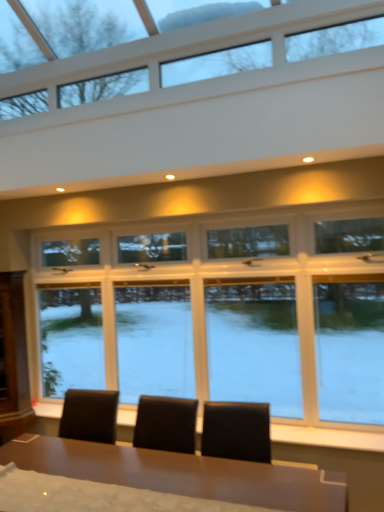
Question: Considering the relative positions of clear glass window at upper center, positioned as the first window in top-to-bottom order, and clear glass window at center, which appears as the 2th window when viewed from the top, in the image provided, is clear glass window at upper center, positioned as the first window in top-to-bottom order, in front of clear glass window at center, which appears as the 2th window when viewed from the top,?

Choices:
 (A) no
 (B) yes

Answer: (B)

Question: Can you see clear glass window at upper center, positioned as the first window in top-to-bottom order, touching clear glass window at center, which appears as the 2th window when viewed from the top?

Choices:
 (A) yes
 (B) no

Answer: (B)

Question: Can you confirm if clear glass window at upper center, the second window in the bottom-to-top sequence, is bigger than clear glass window at center, which is the first window from bottom to top?

Choices:
 (A) no
 (B) yes

Answer: (A)

Question: Is clear glass window at upper center, the second window in the bottom-to-top sequence, turned away from clear glass window at center, which appears as the 2th window when viewed from the top?

Choices:
 (A) yes
 (B) no

Answer: (B)

Question: From the image's perspective, is clear glass window at upper center, positioned as the first window in top-to-bottom order, beneath clear glass window at center, which is the first window from bottom to top?

Choices:
 (A) yes
 (B) no

Answer: (B)

Question: Does clear glass window at upper center, positioned as the first window in top-to-bottom order, appear on the left side of clear glass window at center, which is the first window from bottom to top?

Choices:
 (A) no
 (B) yes

Answer: (B)

Question: From a real-world perspective, is clear glass window at center, which appears as the 2th window when viewed from the top, on clear glass window at upper center, the second window in the bottom-to-top sequence?

Choices:
 (A) yes
 (B) no

Answer: (B)

Question: Is clear glass window at center, which appears as the 2th window when viewed from the top, aimed at clear glass window at upper center, positioned as the first window in top-to-bottom order?

Choices:
 (A) no
 (B) yes

Answer: (B)

Question: Is clear glass window at upper center, positioned as the first window in top-to-bottom order, a part of clear glass window at center, which appears as the 2th window when viewed from the top?

Choices:
 (A) yes
 (B) no

Answer: (B)

Question: From the image's perspective, is clear glass window at center, which appears as the 2th window when viewed from the top, over clear glass window at upper center, the second window in the bottom-to-top sequence?

Choices:
 (A) no
 (B) yes

Answer: (A)

Question: Is clear glass window at center, which is the first window from bottom to top, positioned with its back to clear glass window at upper center, the second window in the bottom-to-top sequence?

Choices:
 (A) no
 (B) yes

Answer: (A)

Question: Is clear glass window at center, which is the first window from bottom to top, directly adjacent to clear glass window at upper center, the second window in the bottom-to-top sequence?

Choices:
 (A) no
 (B) yes

Answer: (A)

Question: Is shiny brown table at center bigger than clear glass window at upper center, the second window in the bottom-to-top sequence?

Choices:
 (A) yes
 (B) no

Answer: (A)